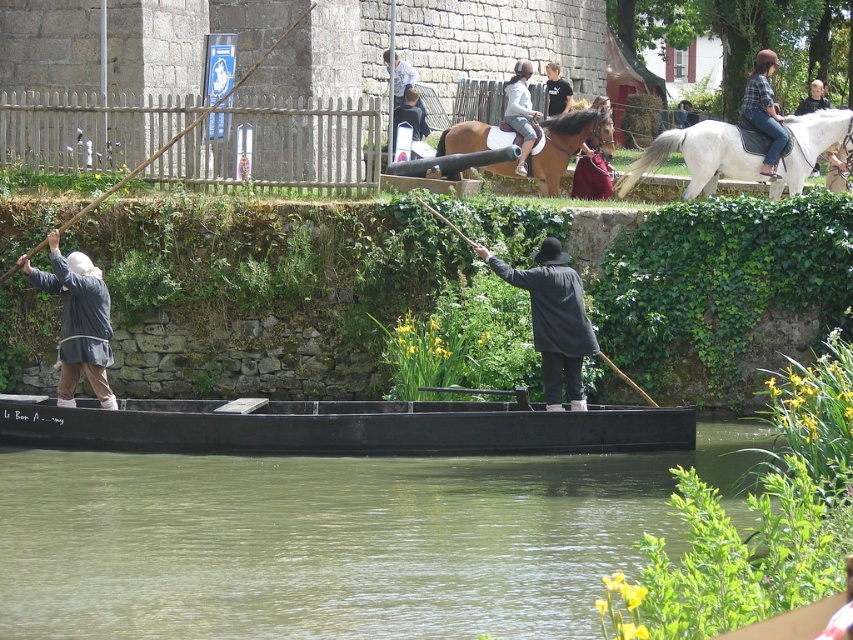
Is point (4, 404) positioned behind point (486, 168)?

No.

Between point (654, 417) and point (534, 173), which one is positioned in front?

Point (654, 417) is more forward.

Does point (177, 433) come behind point (602, 154)?

No, it is not.

The image size is (853, 640). Find the location of `black matte canoe at center`. black matte canoe at center is located at coordinates (341, 428).

Between point (520, 458) and point (566, 88), which one is positioned in front?

Point (520, 458) is in front.

Does point (555, 458) come closer to viewer compared to point (547, 61)?

Yes.

The image size is (853, 640). Describe the element at coordinates (334, 540) in the screenshot. I see `green water at lower center` at that location.

This screenshot has width=853, height=640. In order to click on green water at lower center in this screenshot , I will do `click(334, 540)`.

Is white glossy horse at upper right taller than white cotton shirt at center?

Incorrect, white glossy horse at upper right's height is not larger of white cotton shirt at center's.

Between white glossy horse at upper right and white cotton shirt at center, which one is positioned lower?

Positioned lower is white glossy horse at upper right.

At what (x,y) coordinates should I click in order to perform the action: click on white glossy horse at upper right. Please return your answer as a coordinate pair (x, y). This screenshot has height=640, width=853. Looking at the image, I should click on (697, 157).

Locate an element on the screen. The height and width of the screenshot is (640, 853). white glossy horse at upper right is located at coordinates (697, 157).